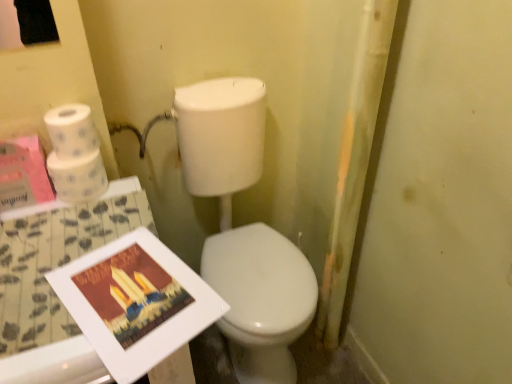
Where is `free location above matte paper magazine at lower left (from a real-world perspective)`? This screenshot has width=512, height=384. free location above matte paper magazine at lower left (from a real-world perspective) is located at coordinates (131, 292).